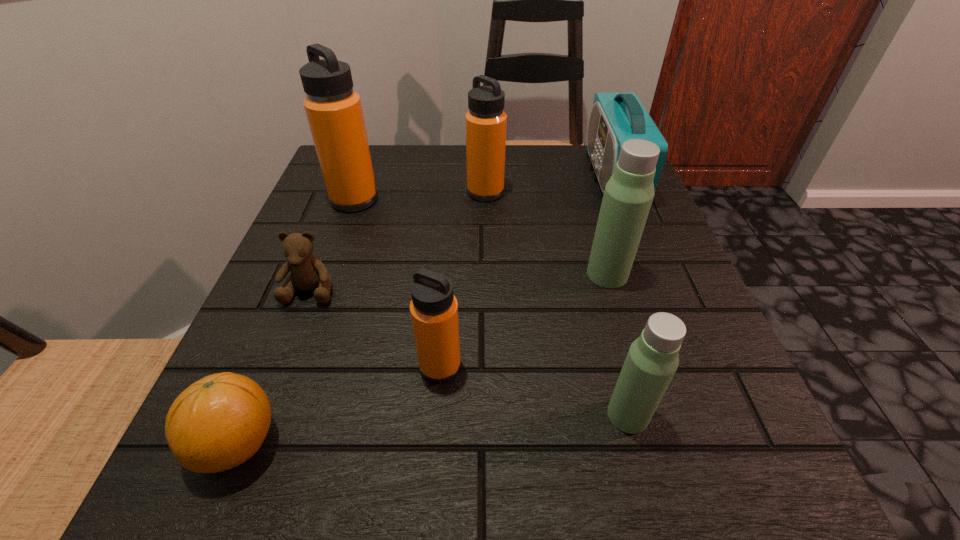
Locate an element on the screen. vacant area between the tallest object and the second biggest orange thermos bottle is located at coordinates (550, 184).

The width and height of the screenshot is (960, 540). I want to click on free space between the light radio receiver and the nearest thermos bottle, so click(x=621, y=295).

The width and height of the screenshot is (960, 540). Find the location of `vacant space that is in between the orange and the teddy bear`. vacant space that is in between the orange and the teddy bear is located at coordinates (274, 366).

This screenshot has width=960, height=540. Find the location of `blank region between the nearest orange thermos bottle and the brown teddy bear`. blank region between the nearest orange thermos bottle and the brown teddy bear is located at coordinates (375, 328).

Locate an element on the screen. empty space between the orange and the seventh shortest object is located at coordinates (296, 321).

Where is `vacant space that is in between the second smallest orange thermos bottle and the fourth farthest thermos bottle`? vacant space that is in between the second smallest orange thermos bottle and the fourth farthest thermos bottle is located at coordinates (463, 279).

Find the location of a particular element. This screenshot has width=960, height=540. free point between the light radio receiver and the nearer light thermos bottle is located at coordinates (621, 295).

Locate an element on the screen. The height and width of the screenshot is (540, 960). vacant area that lies between the smallest orange thermos bottle and the orange is located at coordinates tap(339, 404).

Find the location of a particular element. The width and height of the screenshot is (960, 540). object that is the fourth closest to the second biggest orange thermos bottle is located at coordinates (308, 273).

Locate which object ranks sixth in proximity to the light radio receiver. Please provide its 2D coordinates. Your answer should be formatted as a tuple, i.e. [(x, y)], where the tuple contains the x and y coordinates of a point satisfying the conditions above.

[(308, 273)]